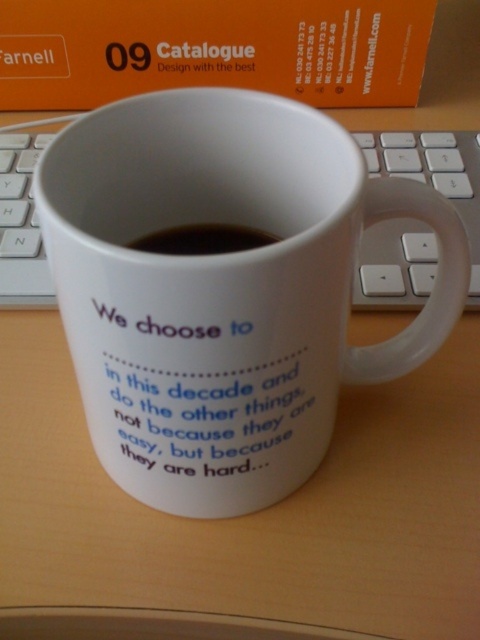
Based on the photo, can you confirm if white matte text at center is positioned to the left of white plastic keyboard at center?

Correct, you'll find white matte text at center to the left of white plastic keyboard at center.

Which is below, white matte text at center or white plastic keyboard at center?

white matte text at center is below.

Locate an element on the screen. white matte text at center is located at coordinates (202, 394).

The height and width of the screenshot is (640, 480). I want to click on white matte text at center, so click(x=202, y=394).

Who is positioned more to the right, white ceramic mug at center or black liquid at center?

white ceramic mug at center

Is white ceramic mug at center to the right of black liquid at center from the viewer's perspective?

Yes, white ceramic mug at center is to the right of black liquid at center.

The height and width of the screenshot is (640, 480). What are the coordinates of `white ceramic mug at center` in the screenshot? It's located at (224, 289).

Can you confirm if white ceramic mug at center is wider than white matte text at center?

Yes.

Which is behind, point (350, 188) or point (175, 438)?

Positioned behind is point (175, 438).

At what (x,y) coordinates should I click in order to perform the action: click on white ceramic mug at center. Please return your answer as a coordinate pair (x, y). This screenshot has width=480, height=640. Looking at the image, I should click on click(x=224, y=289).